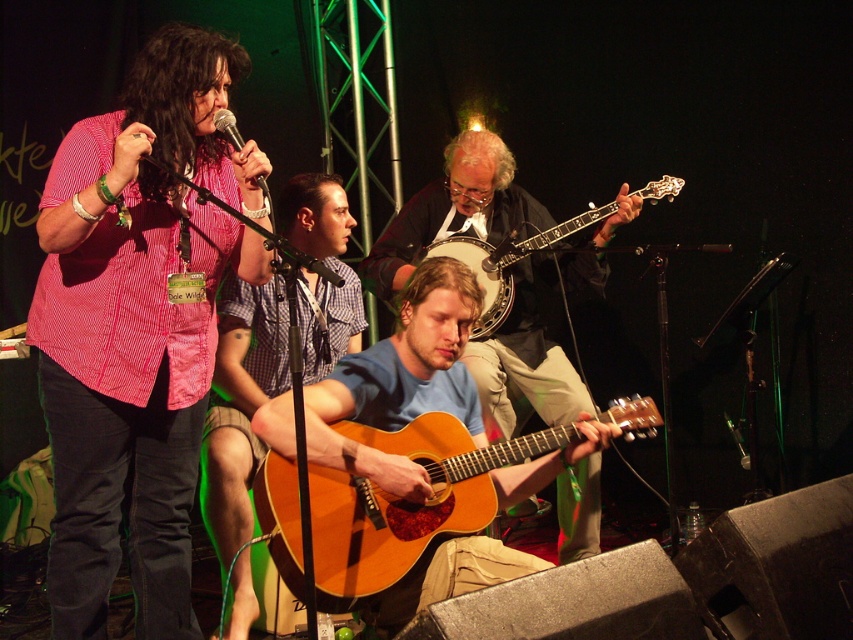
Based on the photo, does light brown acoustic guitar at center have a lesser width compared to light brown wood acoustic guitar at center?

Correct, light brown acoustic guitar at center's width is less than light brown wood acoustic guitar at center's.

What are the coordinates of `light brown acoustic guitar at center` in the screenshot? It's located at (454, 211).

Which is in front, point (563, 499) or point (379, 557)?

Point (379, 557) is in front.

Find the location of `light brown acoustic guitar at center`. light brown acoustic guitar at center is located at coordinates (454, 211).

Between light brown acoustic guitar at center and matte black microphone at upper center, which one appears on the right side from the viewer's perspective?

From the viewer's perspective, light brown acoustic guitar at center appears more on the right side.

Does light brown acoustic guitar at center appear over matte black microphone at upper center?

No, light brown acoustic guitar at center is not above matte black microphone at upper center.

Identify the location of light brown acoustic guitar at center. (454, 211).

Is matte pink shirt at center bigger than matte black microphone at upper center?

Correct, matte pink shirt at center is larger in size than matte black microphone at upper center.

Can you confirm if matte pink shirt at center is positioned to the right of matte black microphone at upper center?

In fact, matte pink shirt at center is to the left of matte black microphone at upper center.

The height and width of the screenshot is (640, 853). Identify the location of matte pink shirt at center. (137, 326).